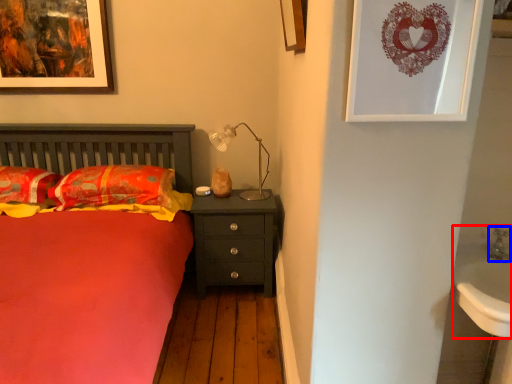
Question: Among these objects, which one is farthest to the camera, sink (highlighted by a red box) or faucet (highlighted by a blue box)?

Choices:
 (A) sink
 (B) faucet

Answer: (B)